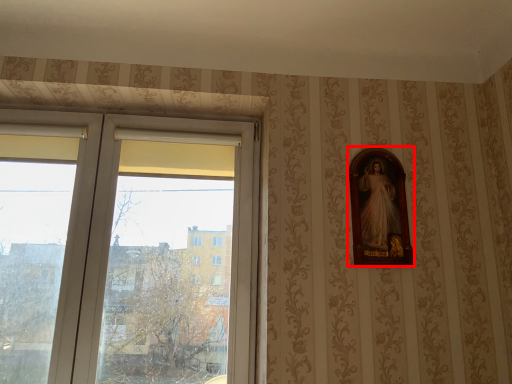
Question: Observing the image, what is the correct spatial positioning of picture frame (annotated by the red box) in reference to window?

Choices:
 (A) left
 (B) right

Answer: (B)